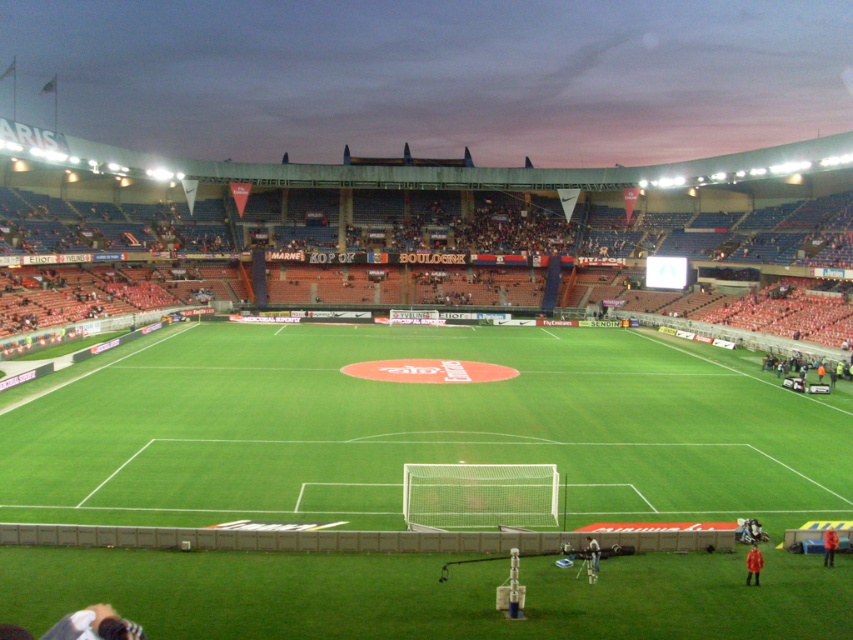
You are a photographer standing at the edge of the stadium field. You want to capture a photo that includes both the green grass football field at center and the red jacket at center. Which object should you zoom in on to ensure both are fully visible in the frame?

The green grass football field at center is wider than the red jacket at center, so you should zoom in on the green grass football field at center to ensure both are fully visible in the frame.

In the scene shown: You are a photographer standing at the edge of the field. You want to take a photo that includes both the green grass football field at center and the red jacket at center. Based on their positions, which object should you position closer to the left side of your camera frame?

The green grass football field at center is to the left of the red jacket at center, so you should position the green grass football field at center closer to the left side of your camera frame.

You are a photographer at the soccer stadium and want to capture a photo of both the red fabric jacket at lower right and the red fabric person at lower center in the same frame. Based on their positions, which one should you focus on first to ensure both are in the shot?

The red fabric jacket at lower right is located below the red fabric person at lower center. To capture both in the same frame, focus on the red fabric person at lower center first as it is higher up, allowing the jacket below to naturally fall into the shot.